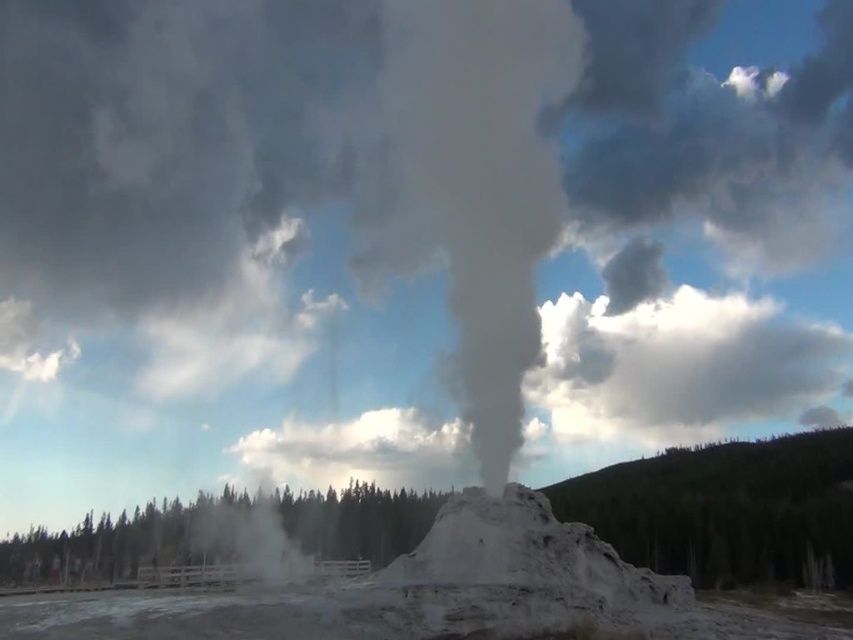
Question: Is white smoke at center positioned at the back of green wood trees at lower center?

Choices:
 (A) no
 (B) yes

Answer: (A)

Question: Which of the following is the farthest from the observer?

Choices:
 (A) white smoke at center
 (B) green wood trees at lower center

Answer: (B)

Question: Which point is closer to the camera taking this photo?

Choices:
 (A) (422, 108)
 (B) (360, 506)
 (C) (474, 392)

Answer: (C)

Question: Does white smoke at center have a lesser width compared to gray/cloudy smoke at center?

Choices:
 (A) no
 (B) yes

Answer: (A)

Question: Considering the relative positions of white smoke at center and gray/cloudy smoke at center in the image provided, where is white smoke at center located with respect to gray/cloudy smoke at center?

Choices:
 (A) above
 (B) below

Answer: (B)

Question: Which point is farther from the camera taking this photo?

Choices:
 (A) (527, 282)
 (B) (329, 518)

Answer: (B)